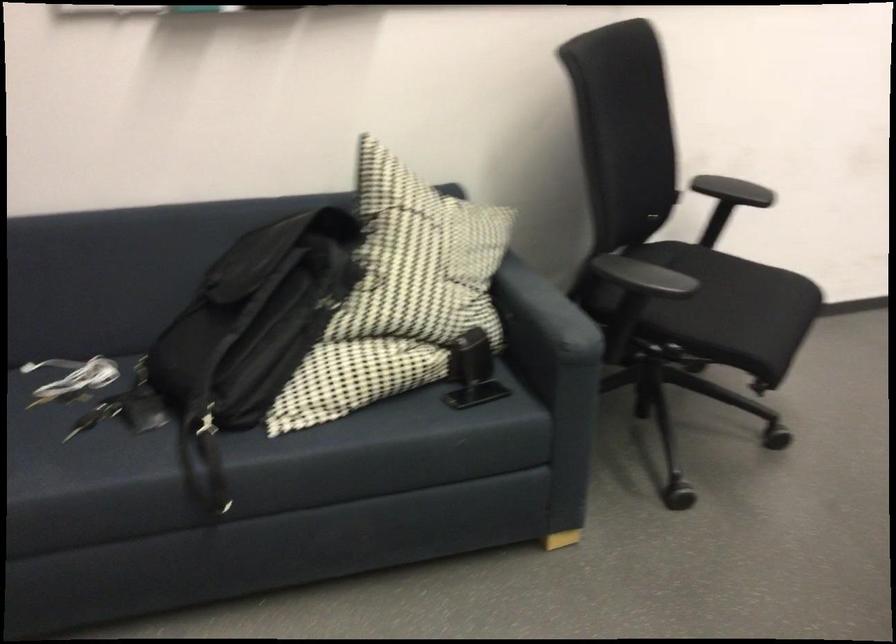
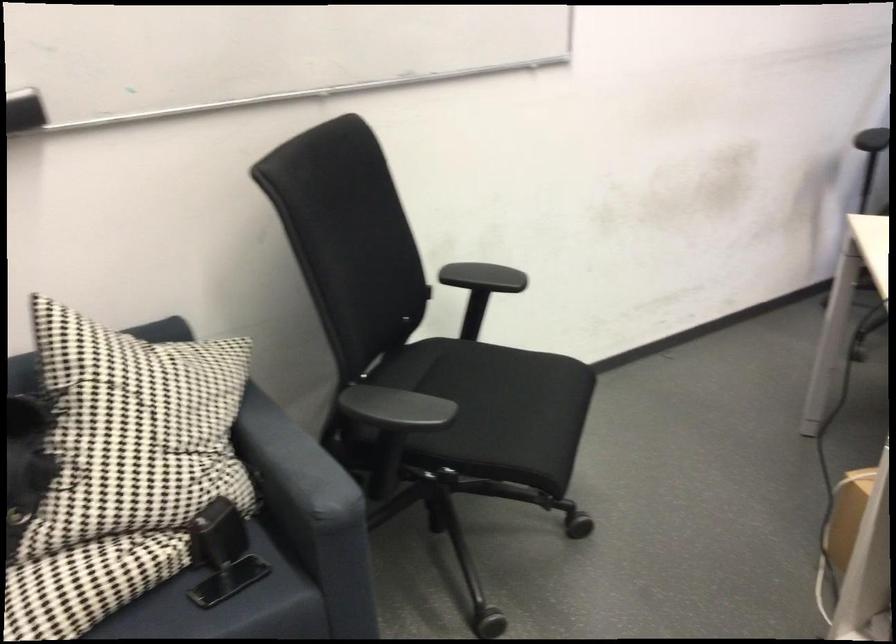
The point at (642, 275) is marked in the first image. Where is the corresponding point in the second image?

(395, 408)